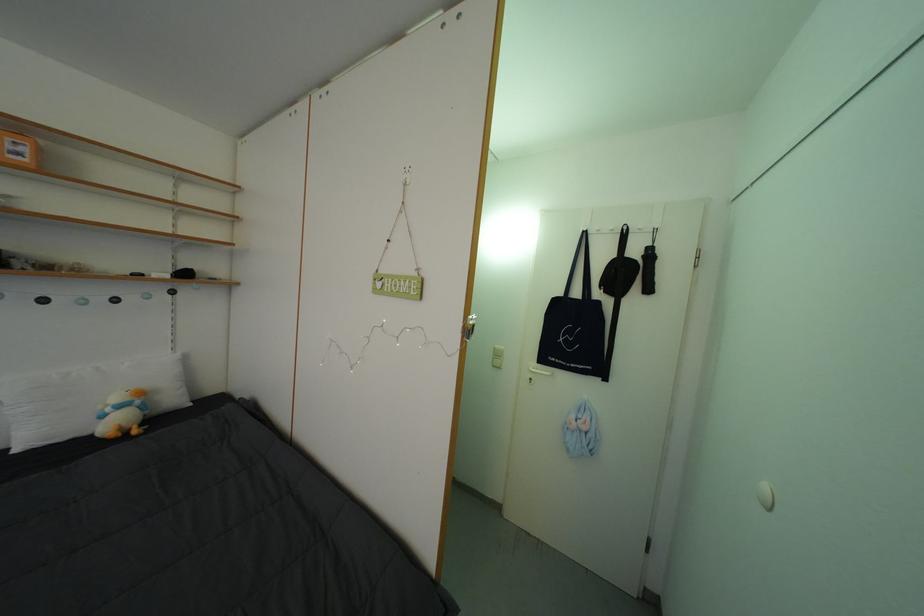
Find where to grasp the black pouch. Please return your answer as a coordinate pair (x, y).

(618, 270)